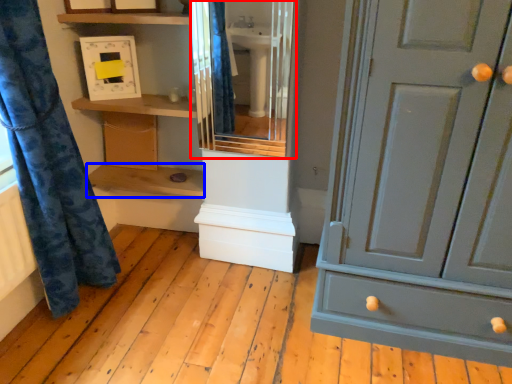
Question: Which of the following is the farthest to the observer, cabinet (highlighted by a red box) or shelf (highlighted by a blue box)?

Choices:
 (A) cabinet
 (B) shelf

Answer: (B)